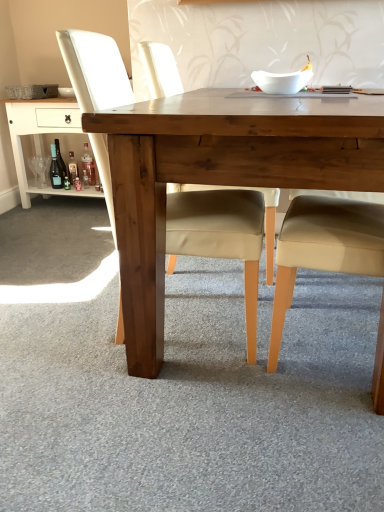
Question: Can you confirm if translucent glass bottle at lower left, which is the second bottle in right-to-left order, is thinner than wooden table at lower left?

Choices:
 (A) no
 (B) yes

Answer: (B)

Question: Is translucent glass bottle at lower left, which is the second bottle in right-to-left order, facing away from wooden table at lower left?

Choices:
 (A) no
 (B) yes

Answer: (B)

Question: From a real-world perspective, is translucent glass bottle at lower left, which appears as the 2th bottle when viewed from the left, positioned under wooden table at lower left based on gravity?

Choices:
 (A) yes
 (B) no

Answer: (A)

Question: Considering the relative sizes of translucent glass bottle at lower left, which is the second bottle in right-to-left order, and wooden table at lower left in the image provided, is translucent glass bottle at lower left, which is the second bottle in right-to-left order, wider than wooden table at lower left?

Choices:
 (A) yes
 (B) no

Answer: (B)

Question: Is translucent glass bottle at lower left, which is the second bottle in right-to-left order, smaller than wooden table at lower left?

Choices:
 (A) no
 (B) yes

Answer: (B)

Question: Considering the positions of point (56, 187) and point (263, 79), is point (56, 187) closer or farther from the camera than point (263, 79)?

Choices:
 (A) farther
 (B) closer

Answer: (A)

Question: Is matte glass bottle at lower left, which is counted as the third bottle, starting from the right, taller or shorter than white glossy bowl at upper center?

Choices:
 (A) short
 (B) tall

Answer: (B)

Question: Is matte glass bottle at lower left, the 1th bottle viewed from the left, in front of or behind white glossy bowl at upper center in the image?

Choices:
 (A) front
 (B) behind

Answer: (B)

Question: Is matte glass bottle at lower left, which is counted as the third bottle, starting from the right, wider or thinner than white glossy bowl at upper center?

Choices:
 (A) wide
 (B) thin

Answer: (B)

Question: Does point (309, 75) appear closer or farther from the camera than point (46, 105)?

Choices:
 (A) closer
 (B) farther

Answer: (A)

Question: Is white glossy bowl at upper center bigger or smaller than wooden table at lower left?

Choices:
 (A) big
 (B) small

Answer: (B)

Question: In terms of width, does white glossy bowl at upper center look wider or thinner when compared to wooden table at lower left?

Choices:
 (A) wide
 (B) thin

Answer: (B)

Question: Is white glossy bowl at upper center inside or outside of wooden table at lower left?

Choices:
 (A) outside
 (B) inside

Answer: (A)

Question: Would you say wooden table at center is to the left or to the right of matte beige chair at center in the picture?

Choices:
 (A) right
 (B) left

Answer: (A)

Question: In terms of width, does wooden table at center look wider or thinner when compared to matte beige chair at center?

Choices:
 (A) thin
 (B) wide

Answer: (B)